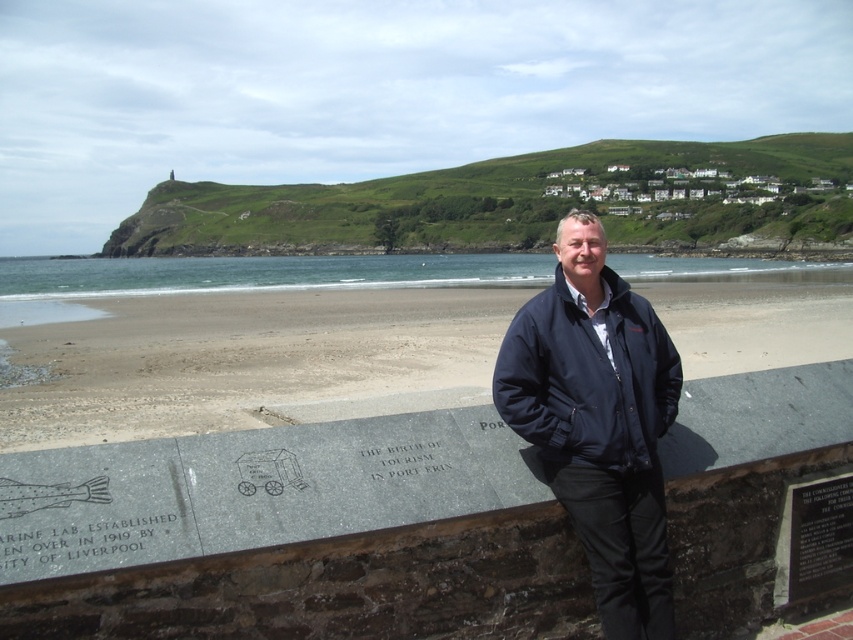
Which is more to the right, gray stone monument at lower center or black stone plaque at lower left?

gray stone monument at lower center is more to the right.

Who is more distant from viewer, (86, 595) or (57, 566)?

Point (86, 595)

Identify the location of gray stone monument at lower center. (323, 540).

The width and height of the screenshot is (853, 640). What do you see at coordinates (598, 420) in the screenshot?
I see `navy blue jacket at center` at bounding box center [598, 420].

Is point (654, 420) behind point (454, 449)?

Yes, point (654, 420) is behind point (454, 449).

Identify the location of navy blue jacket at center. The height and width of the screenshot is (640, 853). (598, 420).

The image size is (853, 640). Identify the location of gray stone monument at lower center. (323, 540).

Image resolution: width=853 pixels, height=640 pixels. Find the location of `gray stone monument at lower center`. gray stone monument at lower center is located at coordinates (323, 540).

This screenshot has width=853, height=640. I want to click on gray stone monument at lower center, so click(323, 540).